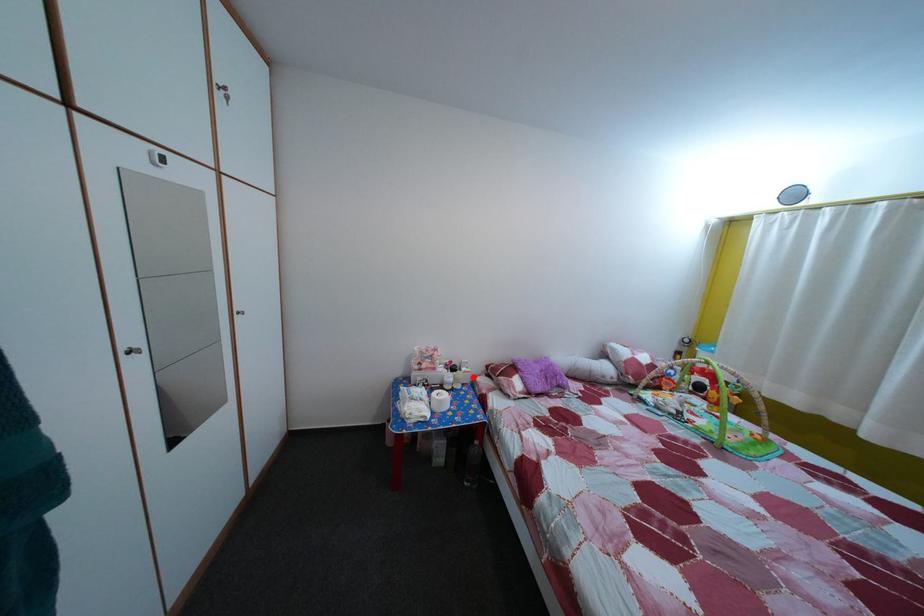
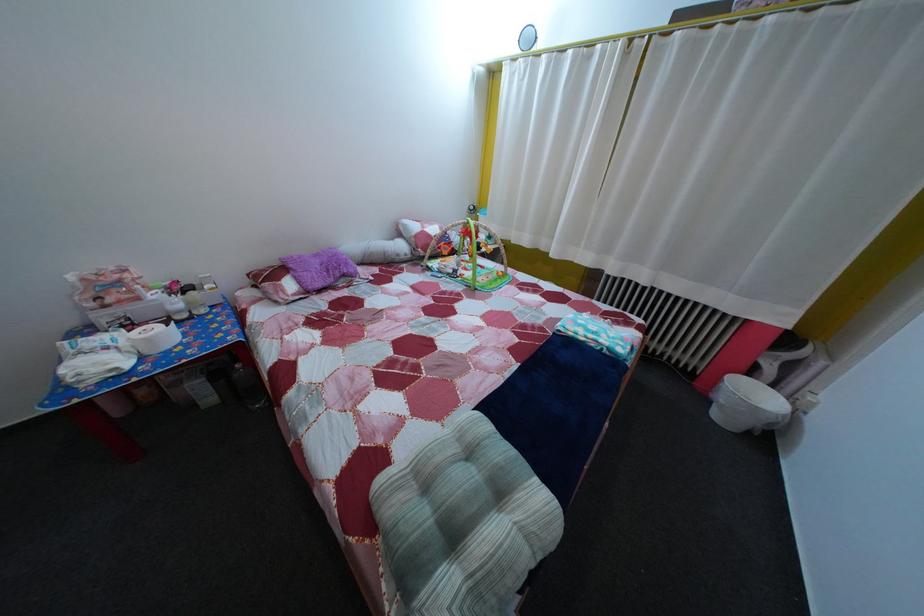
Question: I am providing you with two images of the same scene from different viewpoints. Image1 has a red point marked. In image2, the corresponding 3D location appears at what relative position? Reply with the corresponding letter.

Choices:
 (A) Closer
 (B) Farther

Answer: (A)